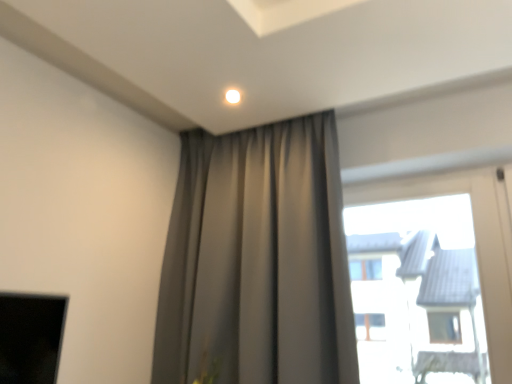
What is the approximate height of transparent glass window at upper right?

transparent glass window at upper right is 93.05 centimeters in height.

What do you see at coordinates (476, 242) in the screenshot? The width and height of the screenshot is (512, 384). I see `transparent glass window at upper right` at bounding box center [476, 242].

Where is `transparent glass window at upper right`? This screenshot has width=512, height=384. transparent glass window at upper right is located at coordinates (476, 242).

This screenshot has width=512, height=384. I want to click on satin gray curtain at upper center, so click(257, 260).

Describe the element at coordinates (257, 260) in the screenshot. I see `satin gray curtain at upper center` at that location.

Find the location of `transparent glass window at upper right`. transparent glass window at upper right is located at coordinates (476, 242).

Based on their positions, is transparent glass window at upper right located to the left or right of satin gray curtain at upper center?

transparent glass window at upper right is positioned on satin gray curtain at upper center's right side.

Is the position of transparent glass window at upper right less distant than that of satin gray curtain at upper center?

No, the depth of transparent glass window at upper right is greater than that of satin gray curtain at upper center.

Considering the points (407, 186) and (207, 182), which point is behind, point (407, 186) or point (207, 182)?

Positioned behind is point (207, 182).

From the image's perspective, which object appears higher, transparent glass window at upper right or satin gray curtain at upper center?

satin gray curtain at upper center appears higher in the image.

From a real-world perspective, is transparent glass window at upper right physically located above or below satin gray curtain at upper center?

transparent glass window at upper right is below satin gray curtain at upper center.

Considering the sizes of objects transparent glass window at upper right and satin gray curtain at upper center in the image provided, who is wider, transparent glass window at upper right or satin gray curtain at upper center?

Wider between the two is satin gray curtain at upper center.

Is transparent glass window at upper right taller or shorter than satin gray curtain at upper center?

Clearly, transparent glass window at upper right is shorter compared to satin gray curtain at upper center.

Considering the sizes of objects transparent glass window at upper right and satin gray curtain at upper center in the image provided, who is smaller, transparent glass window at upper right or satin gray curtain at upper center?

transparent glass window at upper right is smaller.

Do you think transparent glass window at upper right is within satin gray curtain at upper center, or outside of it?

transparent glass window at upper right cannot be found inside satin gray curtain at upper center.

Is there a large distance between transparent glass window at upper right and satin gray curtain at upper center?

They are positioned close to each other.

Is transparent glass window at upper right oriented away from satin gray curtain at upper center?

No, transparent glass window at upper right is not facing away from satin gray curtain at upper center.

Can you tell me how much transparent glass window at upper right and satin gray curtain at upper center differ in facing direction?

The angular difference between transparent glass window at upper right and satin gray curtain at upper center is 1.01 degrees.

Find the location of `curtain that is above the transparent glass window at upper right (from a real-world perspective)`. curtain that is above the transparent glass window at upper right (from a real-world perspective) is located at coordinates (257, 260).

Would you say satin gray curtain at upper center is to the left or to the right of transparent glass window at upper right in the picture?

satin gray curtain at upper center is to the left of transparent glass window at upper right.

Consider the image. Is satin gray curtain at upper center closer to camera compared to transparent glass window at upper right?

That is True.

Considering the points (261, 283) and (351, 187), which point is in front, point (261, 283) or point (351, 187)?

Positioned in front is point (261, 283).

From the image's perspective, is satin gray curtain at upper center located beneath transparent glass window at upper right?

No.

From a real-world perspective, is satin gray curtain at upper center on transparent glass window at upper right?

Yes.

Does satin gray curtain at upper center have a lesser width compared to transparent glass window at upper right?

Incorrect, the width of satin gray curtain at upper center is not less than that of transparent glass window at upper right.

Can you confirm if satin gray curtain at upper center is taller than transparent glass window at upper right?

Yes, satin gray curtain at upper center is taller than transparent glass window at upper right.

Which of these two, satin gray curtain at upper center or transparent glass window at upper right, is smaller?

transparent glass window at upper right.

Is satin gray curtain at upper center surrounding transparent glass window at upper right?

No, transparent glass window at upper right is not a part of satin gray curtain at upper center.

Is satin gray curtain at upper center far from transparent glass window at upper right?

No, satin gray curtain at upper center is in close proximity to transparent glass window at upper right.

Is satin gray curtain at upper center oriented away from transparent glass window at upper right?

satin gray curtain at upper center does not have its back to transparent glass window at upper right.

What's the angular difference between satin gray curtain at upper center and transparent glass window at upper right's facing directions?

The angle between the facing direction of satin gray curtain at upper center and the facing direction of transparent glass window at upper right is 1.01 degrees.

The width and height of the screenshot is (512, 384). Identify the location of window lying below the satin gray curtain at upper center (from the image's perspective). (476, 242).

This screenshot has height=384, width=512. Identify the location of window below the satin gray curtain at upper center (from a real-world perspective). (476, 242).

At what (x,y) coordinates should I click in order to perform the action: click on window to the right of satin gray curtain at upper center. Please return your answer as a coordinate pair (x, y). Image resolution: width=512 pixels, height=384 pixels. Looking at the image, I should click on (476, 242).